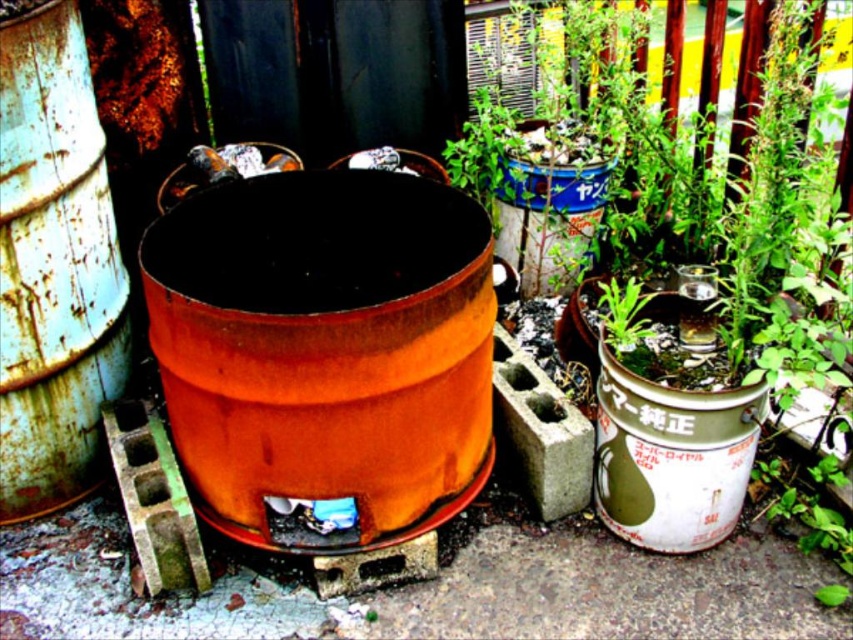
Based on the photo, does rusty metal barrel at center appear on the left side of green matte plant at center?

Correct, you'll find rusty metal barrel at center to the left of green matte plant at center.

Does rusty metal barrel at center come behind green matte plant at center?

No, rusty metal barrel at center is in front of green matte plant at center.

At what (x,y) coordinates should I click in order to perform the action: click on rusty metal barrel at center. Please return your answer as a coordinate pair (x, y). Looking at the image, I should click on (323, 342).

The image size is (853, 640). I want to click on rusty metal barrel at center, so click(323, 342).

Who is more distant from viewer, (722, 292) or (47, 168)?

The point (722, 292) is behind.

Between green matte plant at center and rusty metal barrel at center-left, which one has more height?

With more height is green matte plant at center.

Locate an element on the screen. Image resolution: width=853 pixels, height=640 pixels. green matte plant at center is located at coordinates coord(741,188).

You are a GUI agent. You are given a task and a screenshot of the screen. Output one action in this format:
    pyautogui.click(x=<x>, y=<y>)
    Task: Click on the green matte plant at center
    
    Given the screenshot: What is the action you would take?
    pyautogui.click(x=741, y=188)

Between point (326, 480) and point (125, 273), which one is positioned behind?

The point (125, 273) is behind.

Is rusty metal barrel at center below rusty metal barrel at center-left?

Indeed, rusty metal barrel at center is positioned under rusty metal barrel at center-left.

Describe the element at coordinates (323, 342) in the screenshot. I see `rusty metal barrel at center` at that location.

You are a GUI agent. You are given a task and a screenshot of the screen. Output one action in this format:
    pyautogui.click(x=<x>, y=<y>)
    Task: Click on the rusty metal barrel at center
    This screenshot has width=853, height=640.
    Given the screenshot: What is the action you would take?
    pyautogui.click(x=323, y=342)